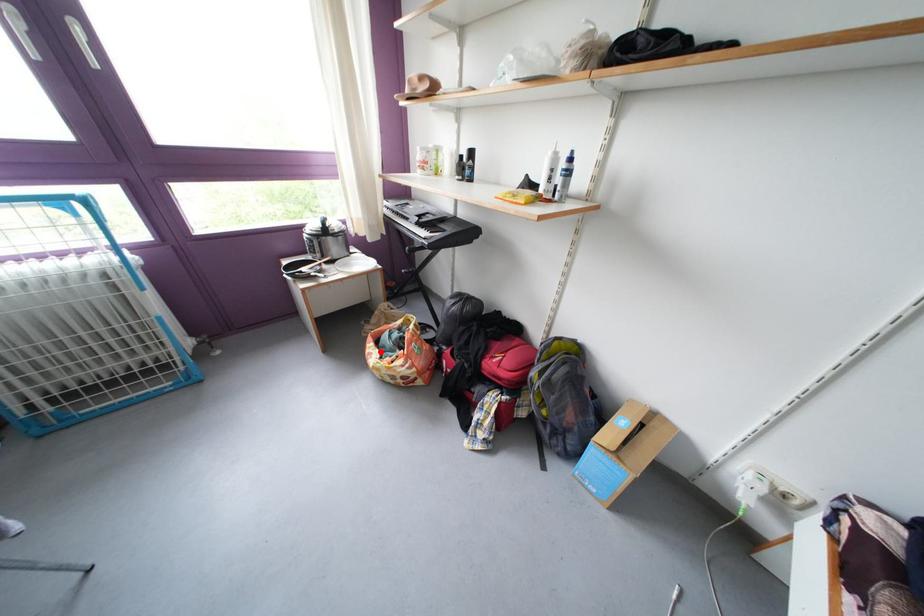
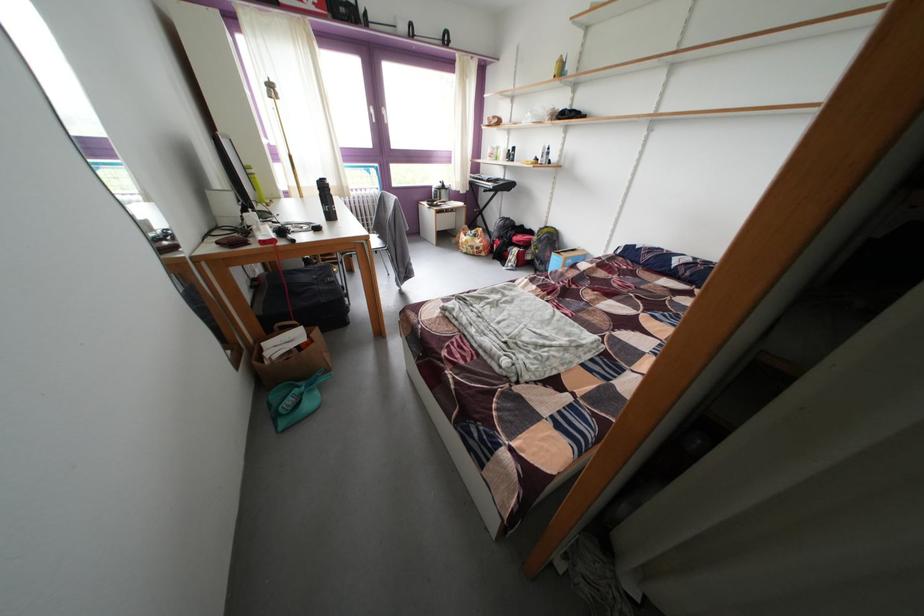
Question: I am providing you with two images of the same scene from different viewpoints. Given a red point in image1, look at the same physical point in image2. Is it:

Choices:
 (A) Closer to the viewpoint
 (B) Farther from the viewpoint

Answer: (A)